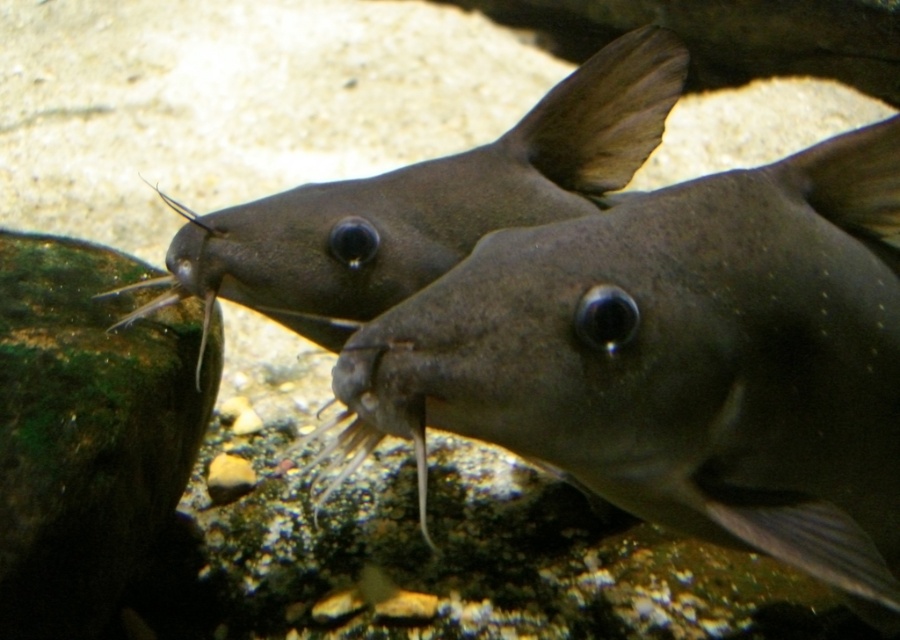
Which is behind, point (829, 563) or point (308, 262)?

The point (308, 262) is behind.

Based on the photo, does smooth gray fish at center have a greater height compared to matte gray fish at center?

Correct, smooth gray fish at center is much taller as matte gray fish at center.

Is point (525, 435) closer to viewer compared to point (451, 211)?

Yes, it is.

This screenshot has height=640, width=900. I want to click on smooth gray fish at center, so (680, 358).